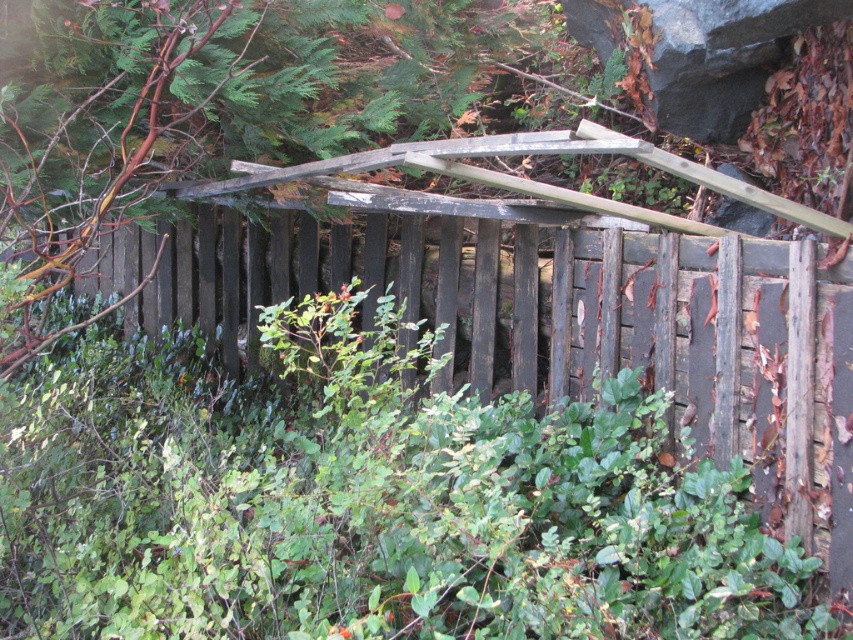
Question: Does weathered wood fence at center have a greater width compared to gray rock at upper right?

Choices:
 (A) no
 (B) yes

Answer: (B)

Question: Which point is closer to the camera?

Choices:
 (A) gray rock at upper right
 (B) weathered wood fence at center

Answer: (B)

Question: Is weathered wood fence at center wider than gray rock at upper right?

Choices:
 (A) no
 (B) yes

Answer: (B)

Question: Which point is closer to the camera taking this photo?

Choices:
 (A) (474, 243)
 (B) (788, 28)

Answer: (B)

Question: Does weathered wood fence at center appear on the left side of gray rock at upper right?

Choices:
 (A) no
 (B) yes

Answer: (B)